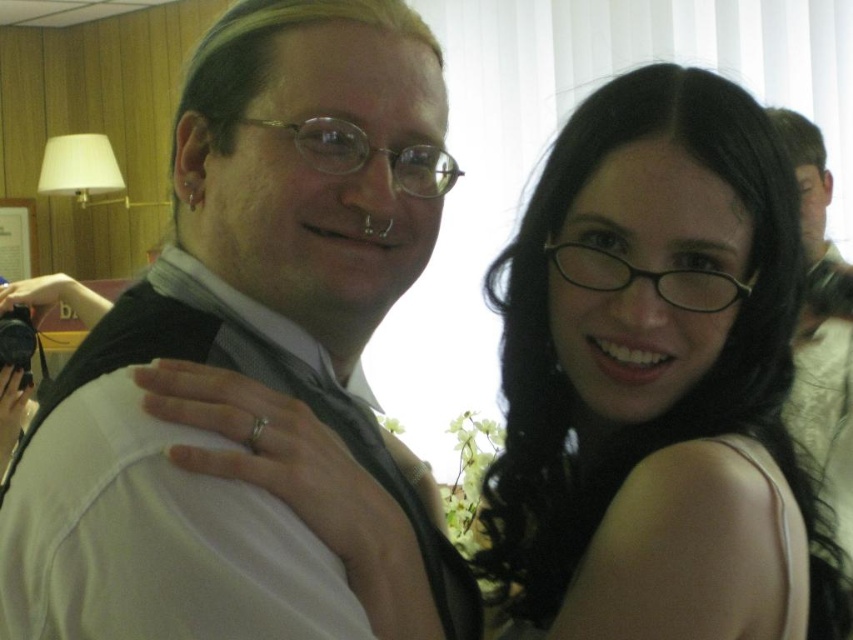
Question: Does white matte vest at upper left have a greater width compared to black glossy hair at upper center?

Choices:
 (A) yes
 (B) no

Answer: (B)

Question: Which is farther from the black glossy hair at upper center?

Choices:
 (A) matte black vest at upper left
 (B) white matte vest at upper left
 (C) black satin tie at upper center

Answer: (A)

Question: Which object appears closest to the camera in this image?

Choices:
 (A) white matte vest at upper left
 (B) matte black vest at upper left
 (C) black satin tie at upper center
 (D) black glossy hair at upper center

Answer: (A)

Question: Is matte black vest at upper left above black satin tie at upper center?

Choices:
 (A) no
 (B) yes

Answer: (B)

Question: Is black glossy hair at upper center thinner than black satin tie at upper center?

Choices:
 (A) no
 (B) yes

Answer: (A)

Question: Estimate the real-world distances between objects in this image. Which object is closer to the black satin tie at upper center?

Choices:
 (A) white matte vest at upper left
 (B) matte black vest at upper left

Answer: (A)